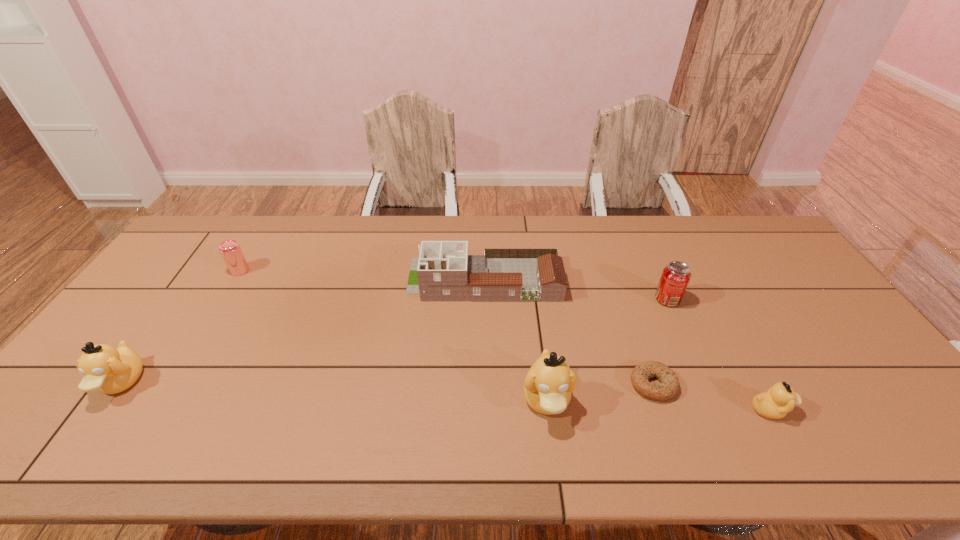
Locate an element on the screen. vacant space that satisfies the following two spatial constraints: 1. at the main entrance of the dollhouse; 2. on the left side of the fourth tallest object is located at coordinates (485, 299).

Identify the location of free space that satisfies the following two spatial constraints: 1. at the main entrance of the dollhouse; 2. on the right side of the bagel. (486, 384).

Identify the location of free space that satisfies the following two spatial constraints: 1. at the main entrance of the dollhouse; 2. on the back side of the third object from right to left. (486, 384).

Find the location of a particular element. This screenshot has height=540, width=960. vacant space that satisfies the following two spatial constraints: 1. on the front side of the third object from right to left; 2. on the right side of the second object from left to right is located at coordinates (170, 384).